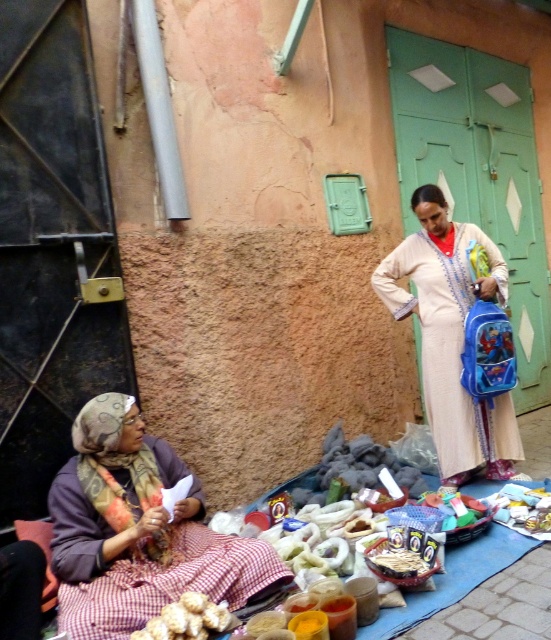
Question: Can you confirm if plaid fabric at lower left is bigger than beige cotton dress at center?

Choices:
 (A) no
 (B) yes

Answer: (B)

Question: Is plaid fabric at lower left smaller than white crumbly food at lower left?

Choices:
 (A) no
 (B) yes

Answer: (A)

Question: Which of the following is the farthest from the observer?

Choices:
 (A) (177, 625)
 (B) (60, 524)
 (C) (437, 396)

Answer: (C)

Question: Based on their relative distances, which object is farther from the plaid fabric at lower left?

Choices:
 (A) beige cotton dress at center
 (B) white crumbly food at lower left

Answer: (A)

Question: Based on their relative distances, which object is farther from the beige cotton dress at center?

Choices:
 (A) white crumbly food at lower left
 (B) plaid fabric at lower left

Answer: (A)

Question: Is plaid fabric at lower left above beige cotton dress at center?

Choices:
 (A) yes
 (B) no

Answer: (B)